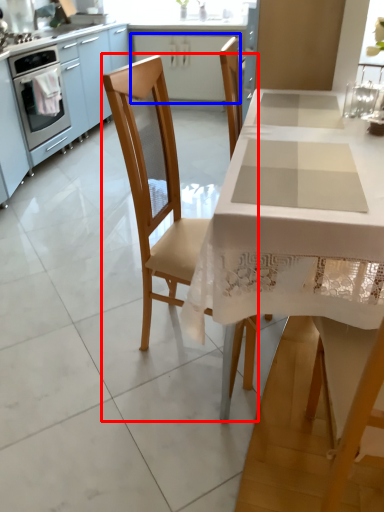
Question: Which point is closer to the camera, chair (highlighted by a red box) or cabinetry (highlighted by a blue box)?

Choices:
 (A) chair
 (B) cabinetry

Answer: (A)